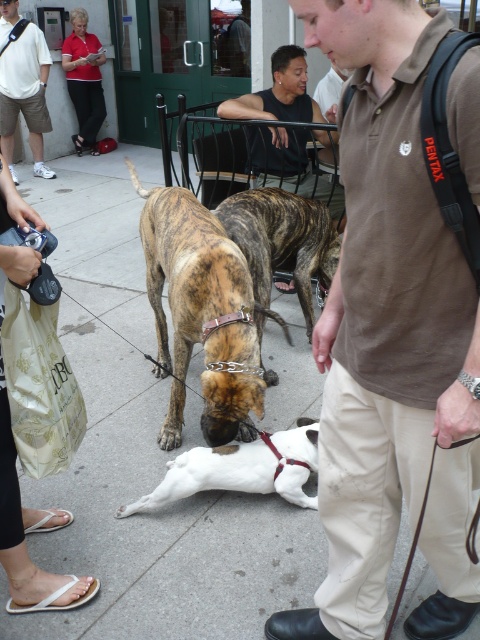
You are a photographer trying to capture a clear shot of the brown cotton shirt at center and the dark brown leather shirt at center. Which one is lower in the frame?

The brown cotton shirt at center is positioned under the dark brown leather shirt at center, so the brown cotton shirt at center is lower in the frame.

You are a photographer trying to capture a clear shot of the brindle leather dog at center and the red shirt at upper left. Since you want both subjects to appear proportionally accurate in the photo, which one should you zoom in on more?

The brindle leather dog at center is larger in size than the red shirt at upper left, so you should zoom in more on the red shirt at upper left to ensure both appear proportionally accurate in the photo.